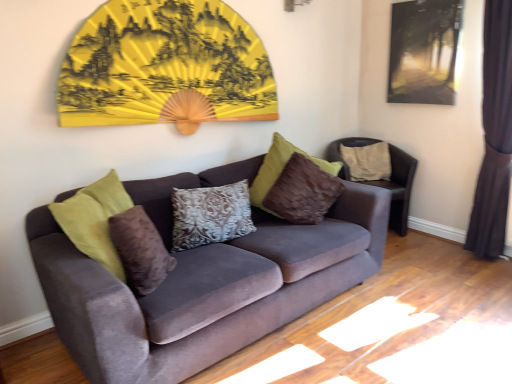
You are a GUI agent. You are given a task and a screenshot of the screen. Output one action in this format:
    pyautogui.click(x=<x>, y=<y>)
    Task: Click on the vacant space situated on the left part of dark brown velvet curtain at right
    Image resolution: width=512 pixels, height=384 pixels.
    Given the screenshot: What is the action you would take?
    click(x=431, y=253)